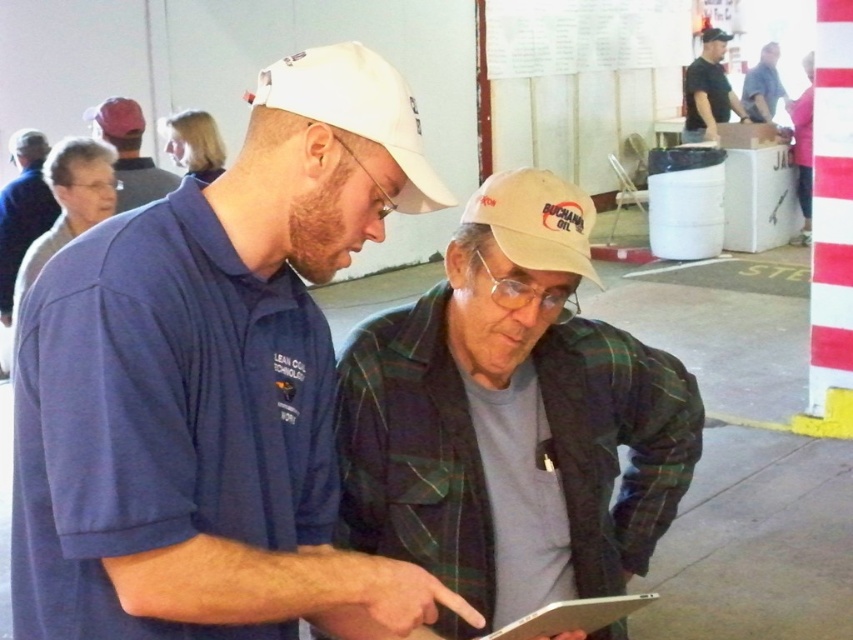
Question: Is the position of plaid flannel shirt at center less distant than that of gray flannel shirt at left?

Choices:
 (A) yes
 (B) no

Answer: (A)

Question: Which point is farther from the camera taking this photo?

Choices:
 (A) (762, 51)
 (B) (167, 564)

Answer: (A)

Question: Can you confirm if white fabric baseball cap at center is positioned below matte black shirt at upper right?

Choices:
 (A) no
 (B) yes

Answer: (B)

Question: Which point is farther to the camera?

Choices:
 (A) matte blue shirt at center
 (B) plaid flannel shirt at center

Answer: (B)

Question: Which point is closer to the camera?

Choices:
 (A) white fabric baseball cap at center
 (B) matte blue shirt at center
 (C) plaid flannel shirt at center

Answer: (B)

Question: Is gray flannel shirt at left to the left of matte gray cap at upper left from the viewer's perspective?

Choices:
 (A) no
 (B) yes

Answer: (B)